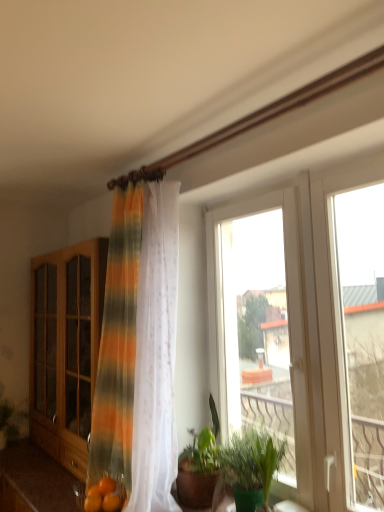
Question: From a real-world perspective, is transparent glass window at center, the third window when ordered from right to left, located beneath wooden cabinet at left?

Choices:
 (A) no
 (B) yes

Answer: (A)

Question: Does transparent glass window at center, which is counted as the first window, starting from the left, come behind wooden cabinet at left?

Choices:
 (A) yes
 (B) no

Answer: (B)

Question: Can you confirm if transparent glass window at center, which is counted as the first window, starting from the left, is smaller than wooden cabinet at left?

Choices:
 (A) no
 (B) yes

Answer: (B)

Question: Are transparent glass window at center, the third window when ordered from right to left, and wooden cabinet at left beside each other?

Choices:
 (A) no
 (B) yes

Answer: (A)

Question: Is transparent glass window at center, which is counted as the first window, starting from the left, facing towards wooden cabinet at left?

Choices:
 (A) yes
 (B) no

Answer: (B)

Question: Can you confirm if transparent glass window at center, the third window when ordered from right to left, is wider than wooden cabinet at left?

Choices:
 (A) no
 (B) yes

Answer: (A)

Question: Can you confirm if wooden cabinet at left is shorter than green matte plant at lower left, the 2th plant in the front-to-back sequence?

Choices:
 (A) no
 (B) yes

Answer: (A)

Question: Is wooden cabinet at left bigger than green matte plant at lower left, which is counted as the 1th plant, starting from the left?

Choices:
 (A) no
 (B) yes

Answer: (B)

Question: From the image's perspective, is wooden cabinet at left on green matte plant at lower left, the 2th plant in the front-to-back sequence?

Choices:
 (A) yes
 (B) no

Answer: (A)

Question: Is wooden cabinet at left to the right of green matte plant at lower left, the second plant viewed from the right, from the viewer's perspective?

Choices:
 (A) no
 (B) yes

Answer: (B)

Question: Does wooden cabinet at left have a lesser width compared to green matte plant at lower left, the 2th plant in the front-to-back sequence?

Choices:
 (A) yes
 (B) no

Answer: (B)

Question: Is wooden cabinet at left far from green matte plant at lower left, the second plant viewed from the right?

Choices:
 (A) no
 (B) yes

Answer: (A)

Question: Is green leafy plant at center, the 1th houseplant from the left, in contact with green leafy plant at lower right, the 2th plant positioned from the back?

Choices:
 (A) no
 (B) yes

Answer: (A)